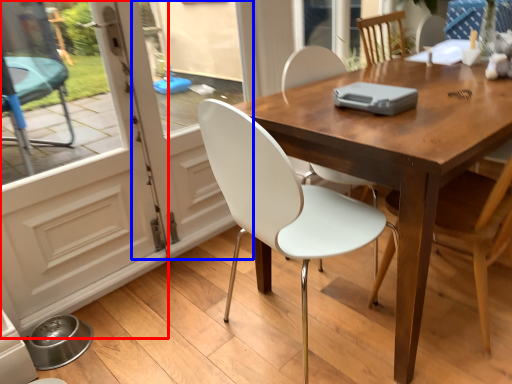
Question: Which object is further to the camera taking this photo, screen door (highlighted by a red box) or screen door (highlighted by a blue box)?

Choices:
 (A) screen door
 (B) screen door

Answer: (B)